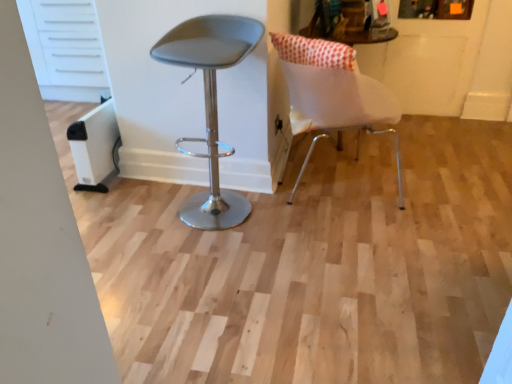
Question: Which direction should I rotate to look at matte gray stool at center, which is the first chair in left-to-right order?

Choices:
 (A) right
 (B) left

Answer: (B)

Question: Is matte gray stool at center, the second chair from the right, wider than white fabric cushion at upper right?

Choices:
 (A) yes
 (B) no

Answer: (B)

Question: Would you say matte gray stool at center, the second chair from the right, is outside white fabric cushion at upper right?

Choices:
 (A) no
 (B) yes

Answer: (B)

Question: Does matte gray stool at center, the second chair from the right, turn towards white fabric cushion at upper right?

Choices:
 (A) yes
 (B) no

Answer: (B)

Question: From the image's perspective, is matte gray stool at center, the second chair from the right, above white fabric cushion at upper right?

Choices:
 (A) no
 (B) yes

Answer: (A)

Question: From a real-world perspective, is matte gray stool at center, the second chair from the right, located higher than white fabric cushion at upper right?

Choices:
 (A) no
 (B) yes

Answer: (A)

Question: Is there a large distance between matte gray stool at center, which is the first chair in left-to-right order, and white fabric cushion at upper right?

Choices:
 (A) no
 (B) yes

Answer: (B)

Question: Is white matte chair at right, the 1th chair when ordered from right to left, taller than matte gray stool at center, which is the first chair in left-to-right order?

Choices:
 (A) yes
 (B) no

Answer: (B)

Question: Is white matte chair at right, the 1th chair when ordered from right to left, far from matte gray stool at center, which is the first chair in left-to-right order?

Choices:
 (A) yes
 (B) no

Answer: (B)

Question: Does white matte chair at right, acting as the 2th chair starting from the left, have a larger size compared to matte gray stool at center, which is the first chair in left-to-right order?

Choices:
 (A) yes
 (B) no

Answer: (A)

Question: From a real-world perspective, is white matte chair at right, acting as the 2th chair starting from the left, over matte gray stool at center, the second chair from the right?

Choices:
 (A) yes
 (B) no

Answer: (B)

Question: Does white matte chair at right, the 1th chair when ordered from right to left, have a smaller size compared to matte gray stool at center, the second chair from the right?

Choices:
 (A) yes
 (B) no

Answer: (B)

Question: Does white matte chair at right, the 1th chair when ordered from right to left, have a lesser width compared to matte gray stool at center, which is the first chair in left-to-right order?

Choices:
 (A) no
 (B) yes

Answer: (A)

Question: Is there a large distance between white matte chair at right, the 1th chair when ordered from right to left, and white fabric cushion at upper right?

Choices:
 (A) yes
 (B) no

Answer: (B)